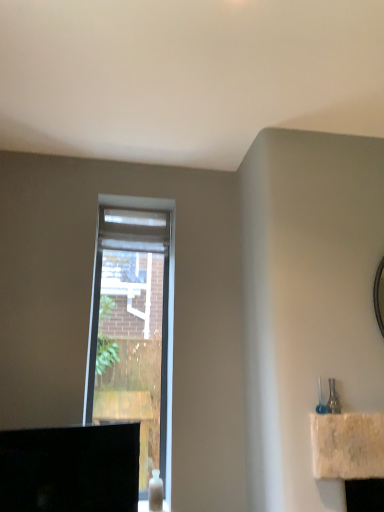
Question: In terms of height, does white sheer curtain at center look taller or shorter compared to clear glass window at center?

Choices:
 (A) short
 (B) tall

Answer: (A)

Question: From the image's perspective, is white sheer curtain at center positioned above or below clear glass window at center?

Choices:
 (A) below
 (B) above

Answer: (B)

Question: Considering the relative positions of white sheer curtain at center and clear glass window at center in the image provided, is white sheer curtain at center to the left or to the right of clear glass window at center?

Choices:
 (A) left
 (B) right

Answer: (B)

Question: Considering the positions of clear glass window at center and white sheer curtain at center in the image, is clear glass window at center taller or shorter than white sheer curtain at center?

Choices:
 (A) tall
 (B) short

Answer: (A)

Question: Which is correct: clear glass window at center is inside white sheer curtain at center, or outside of it?

Choices:
 (A) inside
 (B) outside

Answer: (B)

Question: Is clear glass window at center in front of or behind white sheer curtain at center in the image?

Choices:
 (A) behind
 (B) front

Answer: (B)

Question: Based on their positions, is clear glass window at center located to the left or right of white sheer curtain at center?

Choices:
 (A) left
 (B) right

Answer: (A)